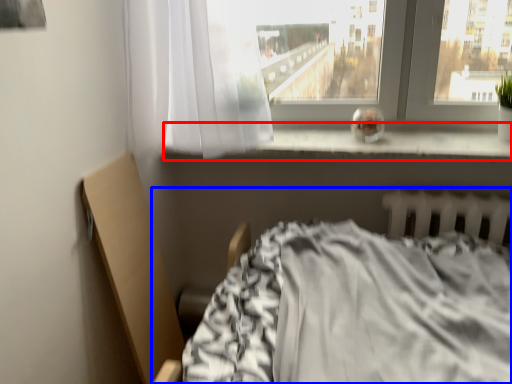
Question: Which point is closer to the camera, window sill (highlighted by a red box) or bed (highlighted by a blue box)?

Choices:
 (A) window sill
 (B) bed

Answer: (B)